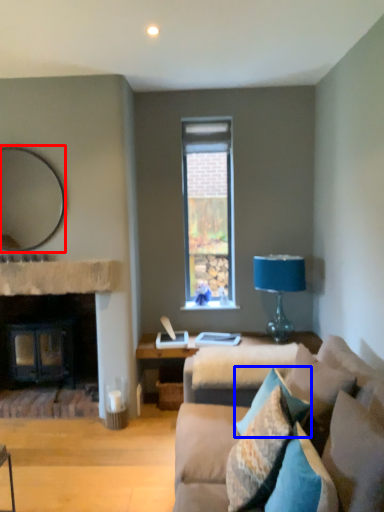
Question: Which object appears farthest to the camera in this image, mirror (highlighted by a red box) or pillow (highlighted by a blue box)?

Choices:
 (A) mirror
 (B) pillow

Answer: (A)